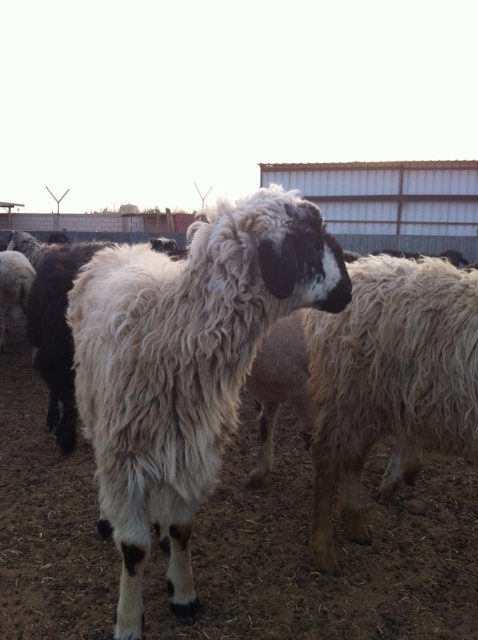
You are a farmer who wants to separate two sheep based on their wool texture. You see a white woolen sheep at center and a white woolly sheep at center. Which one should you move to the left side?

The white woolen sheep at center is positioned on the left side of white woolly sheep at center, so you should move the white woolly sheep at center to the left side to separate them.

You are a photographer trying to capture a closeup of the sheep in the foreground. You have two markers labeled point A at point (129, 340) and point B at point (354, 502). Which point should you focus on to ensure the sheep is in focus?

Point A at point (129, 340) should be focused on because it is closer to the camera than point B at point (354, 502), ensuring the foreground sheep is in focus.